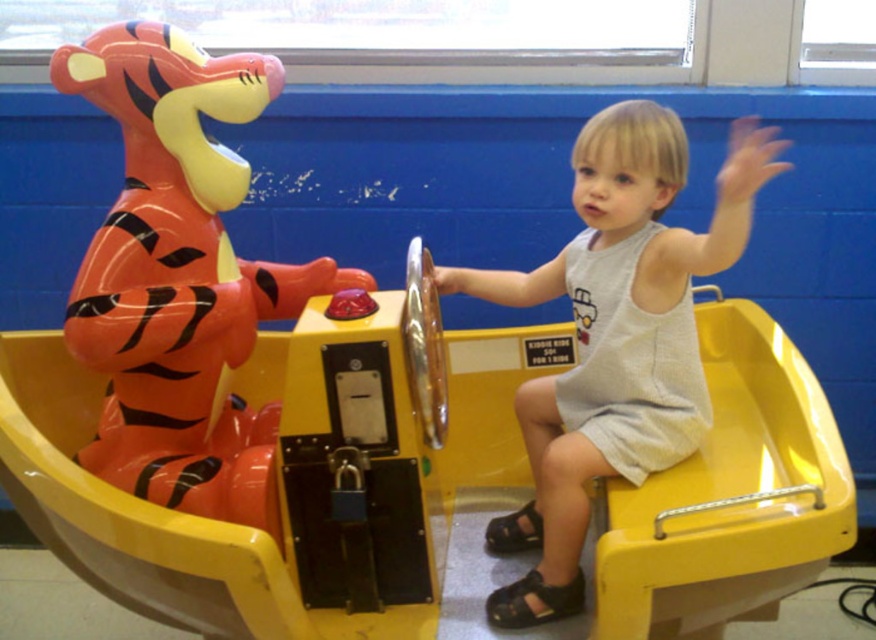
Locate an element on the screen. rubberized orange tiger at left is located at coordinates (179, 276).

Between point (205, 214) and point (588, 476), which one is positioned in front?

Positioned in front is point (588, 476).

The width and height of the screenshot is (876, 640). Find the location of `rubberized orange tiger at left`. rubberized orange tiger at left is located at coordinates (x=179, y=276).